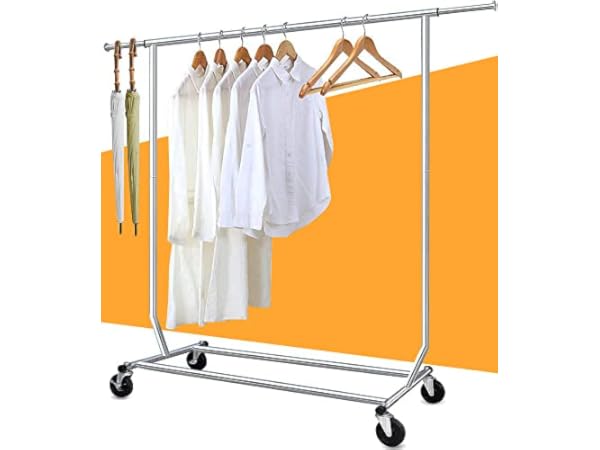
Identify the location of hanging rack wheels. (204, 354), (120, 386), (393, 434), (436, 389).